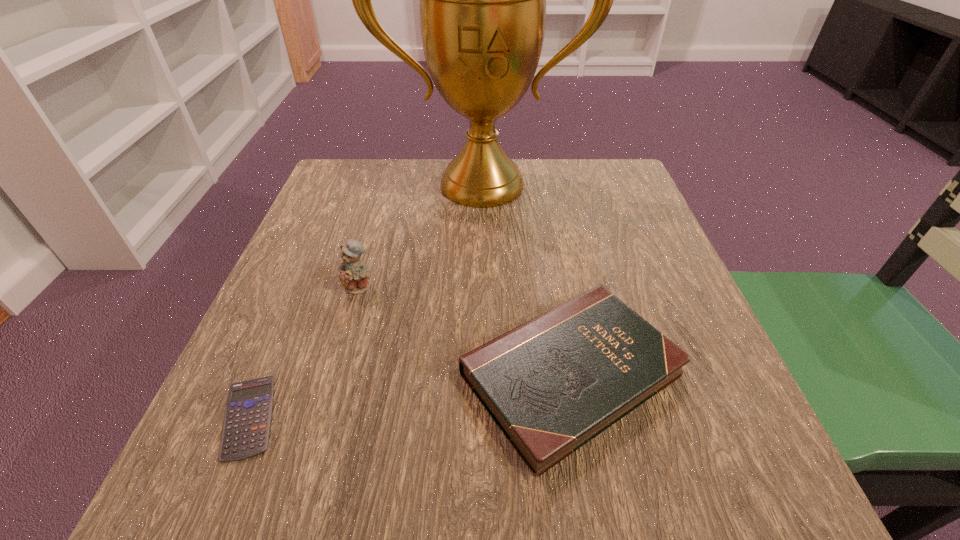
The width and height of the screenshot is (960, 540). What are the coordinates of `free location located on the back of the calculator` in the screenshot? It's located at (314, 262).

The height and width of the screenshot is (540, 960). I want to click on object located at the far edge, so click(x=482, y=0).

You are a GUI agent. You are given a task and a screenshot of the screen. Output one action in this format:
    pyautogui.click(x=<x>, y=<y>)
    Task: Click on the Bible located in the near edge section of the desktop
    
    Given the screenshot: What is the action you would take?
    pyautogui.click(x=552, y=384)

Where is `calculator present at the near edge`? calculator present at the near edge is located at coordinates (246, 427).

Where is `trophy cup that is at the left edge`? trophy cup that is at the left edge is located at coordinates (482, 0).

Locate an element on the screen. The width and height of the screenshot is (960, 540). teddy bear positioned at the left edge is located at coordinates (354, 274).

You are a GUI agent. You are given a task and a screenshot of the screen. Output one action in this format:
    pyautogui.click(x=<x>, y=<y>)
    Task: Click on the calculator that is at the left edge
    The image size is (960, 540).
    Given the screenshot: What is the action you would take?
    pyautogui.click(x=246, y=427)

This screenshot has width=960, height=540. I want to click on trophy cup that is at the right edge, so click(482, 0).

Locate an element on the screen. This screenshot has width=960, height=540. Bible present at the right edge is located at coordinates (552, 384).

I want to click on object present at the far left corner, so click(482, 0).